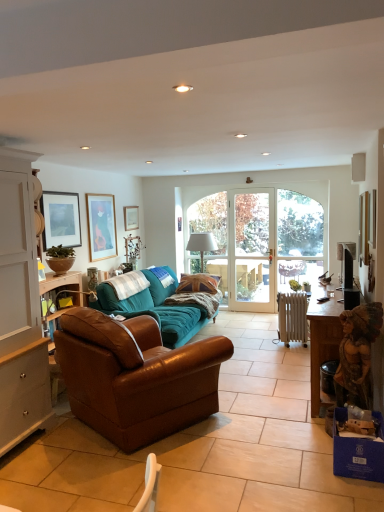
Locate an element on the screen. The image size is (384, 512). free space between brown leather couch at center, acting as the 2th studio couch starting from the back, and white wood cabinet at left is located at coordinates (66, 454).